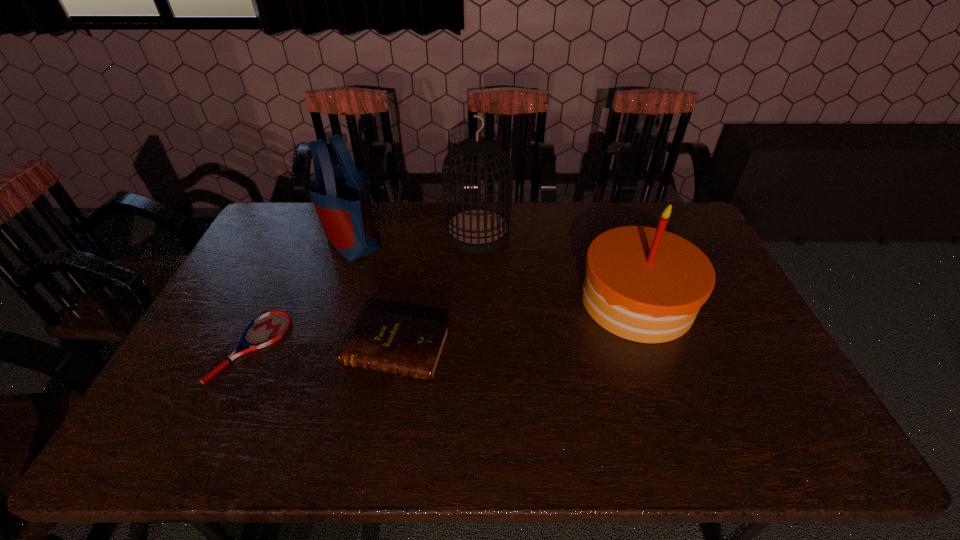
This screenshot has width=960, height=540. In order to click on birdcage in this screenshot , I will do `click(479, 230)`.

Where is `handbag`? handbag is located at coordinates (340, 195).

Identify the location of birthday cake. (644, 284).

What are the coordinates of `hardback book` in the screenshot? It's located at (409, 346).

Find the location of a particular element. tennis racket is located at coordinates pos(266,329).

You are a GUI agent. You are given a task and a screenshot of the screen. Output one action in this format:
    pyautogui.click(x=<x>, y=<y>)
    Task: Click on the free space located on the left of the birdcage
    
    Given the screenshot: What is the action you would take?
    (350, 234)

Find the location of `free space located 0.140m on the front of the handbag`. free space located 0.140m on the front of the handbag is located at coordinates (333, 292).

What are the coordinates of `vacant space located 0.160m on the front of the rightmost object` in the screenshot? It's located at click(x=671, y=398).

Identify the location of vacant area situated 0.210m on the right of the hardback book. (526, 351).

At what (x,y) coordinates should I click in order to perform the action: click on vacant point located 0.080m on the front of the tennis racket. Please return your answer as a coordinate pair (x, y). The width and height of the screenshot is (960, 540). Looking at the image, I should click on (219, 414).